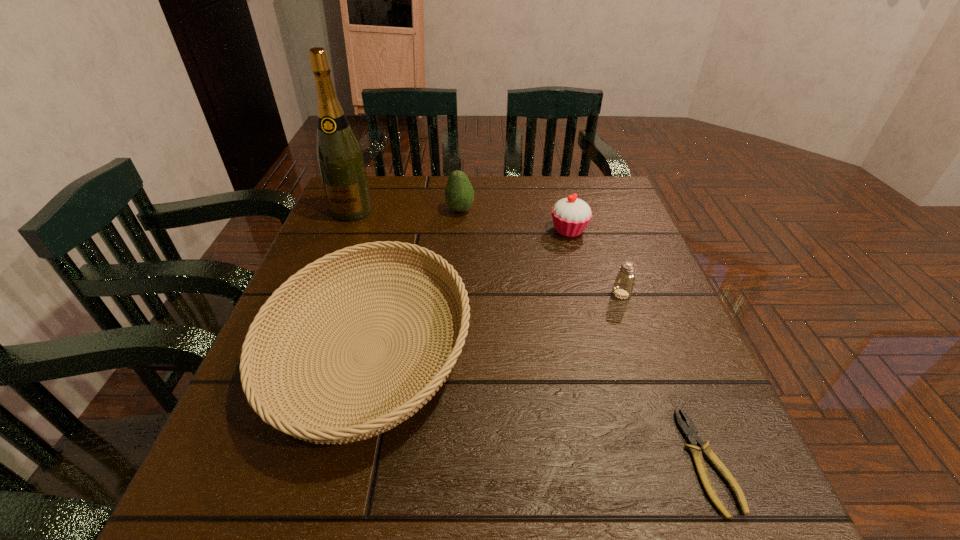
Image resolution: width=960 pixels, height=540 pixels. I want to click on free space at the near right corner of the desktop, so click(x=756, y=499).

Image resolution: width=960 pixels, height=540 pixels. I want to click on empty space between the avocado and the saltshaker, so click(x=540, y=252).

At what (x,y) coordinates should I click in order to perform the action: click on empty space that is in between the saltshaker and the tallest object. Please return your answer as a coordinate pair (x, y). Looking at the image, I should click on (487, 252).

Where is `free point between the saltshaker and the avocado`? This screenshot has width=960, height=540. free point between the saltshaker and the avocado is located at coordinates (540, 252).

I want to click on free space between the fourth object from left to right and the shortest object, so click(x=638, y=346).

You are a GUI agent. You are given a task and a screenshot of the screen. Output one action in this format:
    pyautogui.click(x=<x>, y=<y>)
    Task: Click on the free space between the pliers and the fourth object from left to right
    
    Given the screenshot: What is the action you would take?
    pyautogui.click(x=638, y=346)

Where is `blank region between the pliers and the third object from right to left`? Image resolution: width=960 pixels, height=540 pixels. blank region between the pliers and the third object from right to left is located at coordinates click(x=638, y=346).

You are a GUI agent. You are given a task and a screenshot of the screen. Output one action in this format:
    pyautogui.click(x=<x>, y=<y>)
    Task: Click on the vacant point located between the tallest object and the saltshaker
    Image resolution: width=960 pixels, height=540 pixels.
    Given the screenshot: What is the action you would take?
    (487, 252)

At what (x,y) coordinates should I click in order to perform the action: click on free spot between the basket and the saltshaker. Please return your answer as a coordinate pair (x, y). This screenshot has height=540, width=960. Looking at the image, I should click on (495, 322).

This screenshot has width=960, height=540. I want to click on free area in between the saltshaker and the cupcake, so click(595, 262).